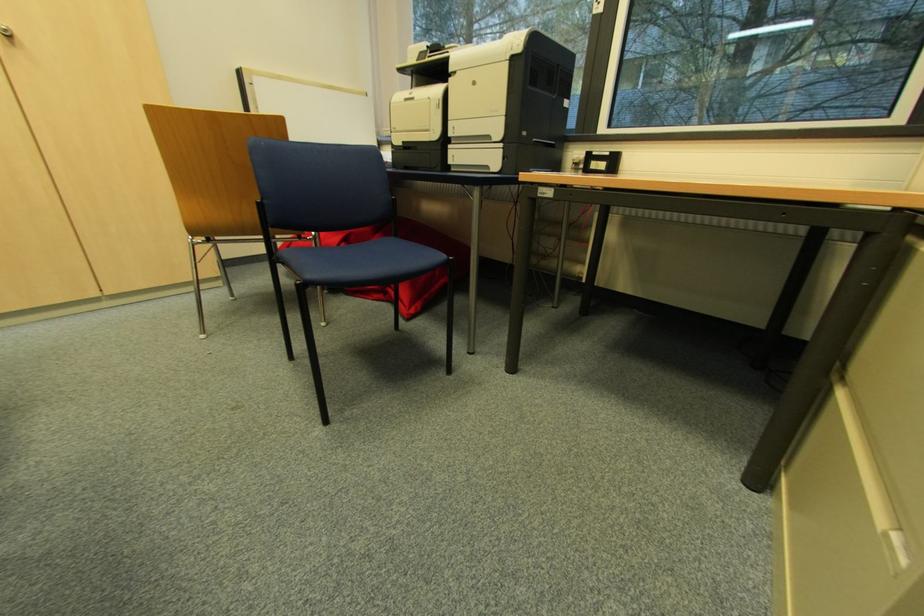
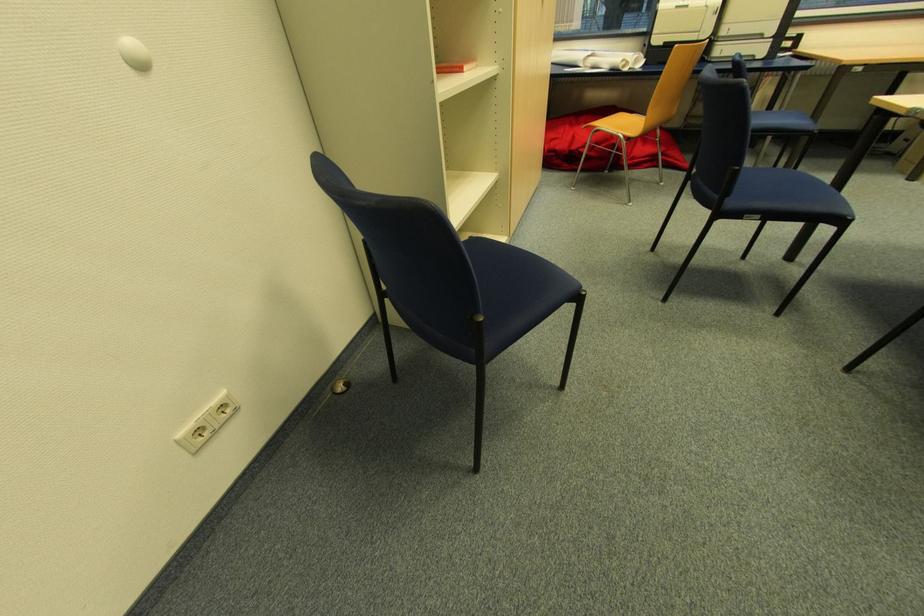
Question: The images are taken continuously from a first-person perspective. In which direction are you moving?

Choices:
 (A) Left
 (B) Right
 (C) Forward
 (D) Backward

Answer: (A)